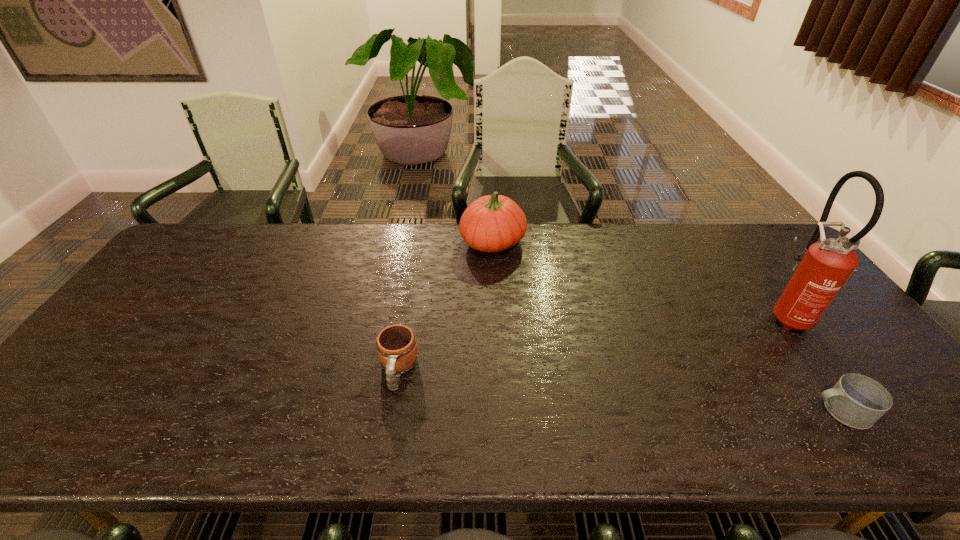
Find the location of a particular element. object at the near right corner is located at coordinates (857, 401).

Find the location of a particular element. The width and height of the screenshot is (960, 540). vacant space at the far edge of the desktop is located at coordinates (265, 234).

What are the coordinates of `free spot at the near edge of the desktop` in the screenshot? It's located at tap(411, 439).

Locate an element on the screen. free space at the left edge of the desktop is located at coordinates (166, 274).

In the image, there is a desktop. At what (x,y) coordinates should I click in order to perform the action: click on vacant space at the right edge. Please return your answer as a coordinate pair (x, y). This screenshot has width=960, height=540. Looking at the image, I should click on (854, 348).

I want to click on free space between the shorter mug and the leftmost object, so click(619, 390).

You are a GUI agent. You are given a task and a screenshot of the screen. Output one action in this format:
    pyautogui.click(x=<x>, y=<y>)
    Task: Click on the vacant area between the second object from left to right and the taller mug
    
    Given the screenshot: What is the action you would take?
    pyautogui.click(x=445, y=306)

The width and height of the screenshot is (960, 540). What are the coordinates of `vacant area that lies between the tallest object and the leftmost object` in the screenshot? It's located at (593, 343).

At what (x,y) coordinates should I click in order to perform the action: click on vacant space in between the right mug and the third nearest object. Please return your answer as a coordinate pair (x, y). The image size is (960, 540). Looking at the image, I should click on (815, 363).

Locate an element on the screen. The width and height of the screenshot is (960, 540). vacant point located between the third nearest object and the second shortest object is located at coordinates (593, 343).